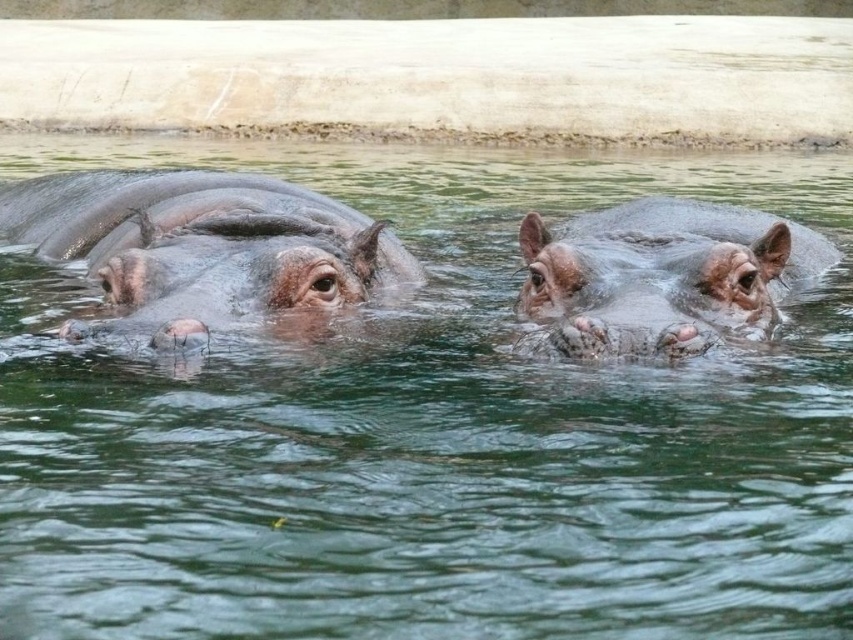
Can you confirm if pinkish-brown skin at center is wider than sandy brown skin at center?

Indeed, pinkish-brown skin at center has a greater width compared to sandy brown skin at center.

Does point (260, 292) come behind point (561, 272)?

Yes, point (260, 292) is behind point (561, 272).

Locate an element on the screen. The height and width of the screenshot is (640, 853). pinkish-brown skin at center is located at coordinates (202, 248).